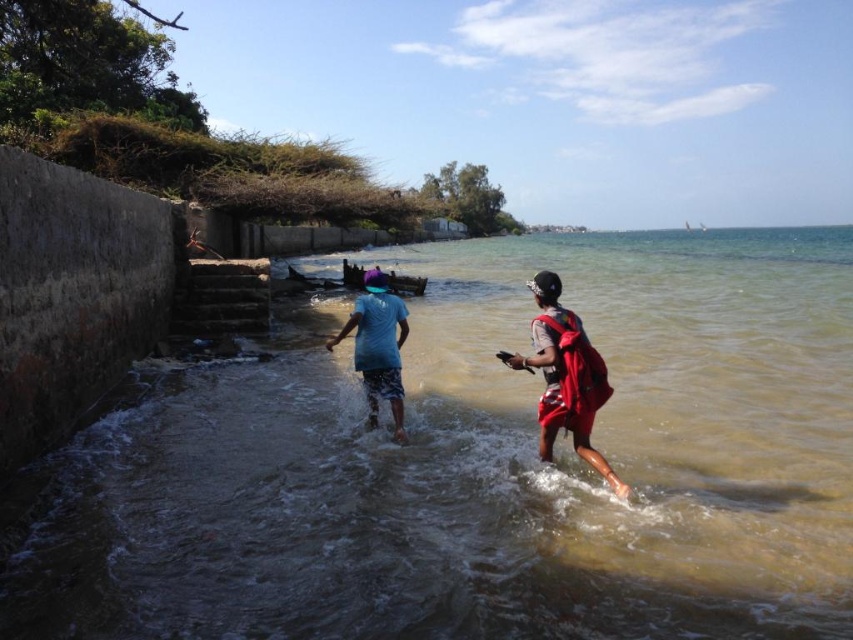
Question: Which of the following is the farthest from the observer?

Choices:
 (A) (421, 552)
 (B) (364, 346)

Answer: (B)

Question: Is blue fabric shirt at center below red fabric bag at center?

Choices:
 (A) yes
 (B) no

Answer: (B)

Question: Which object appears closest to the camera in this image?

Choices:
 (A) brown murky water at center
 (B) blue fabric shirt at center

Answer: (A)

Question: Observing the image, what is the correct spatial positioning of brown murky water at center in reference to blue fabric shirt at center?

Choices:
 (A) right
 (B) left

Answer: (A)

Question: Does blue fabric shirt at center come behind blue cotton shirt at center?

Choices:
 (A) no
 (B) yes

Answer: (A)

Question: Which object appears farthest from the camera in this image?

Choices:
 (A) red fabric bag at center
 (B) blue cotton shirt at center
 (C) brown murky water at center
 (D) blue fabric shirt at center

Answer: (B)